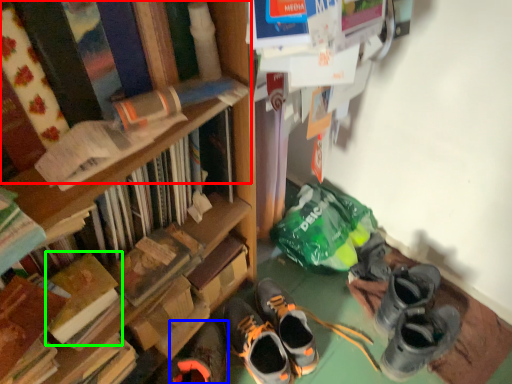
Question: Estimate the real-world distances between objects in this image. Which object is farther from book (highlighted by a red box), footwear (highlighted by a blue box) or book (highlighted by a green box)?

Choices:
 (A) footwear
 (B) book

Answer: (A)